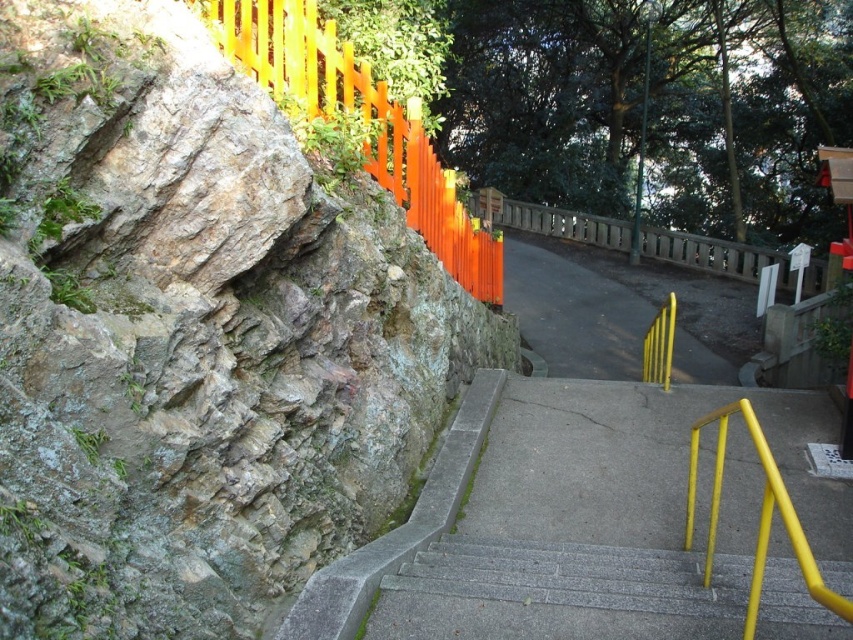
You are standing at the bottom of the staircase and want to reach the orange painted wood fence at upper left. Which direction should you move relative to the rocky cliff at left?

To reach the orange painted wood fence at upper left from the bottom of the staircase, you should move away from the rocky cliff at left since the fence is located above it.

You are a painter who needs to decide which object to paint first between the rocky cliff at left and the orange painted wood fence at upper left. Considering their widths, which one requires more time to paint due to its size?

The rocky cliff at left requires more time to paint because its width is larger than the orange painted wood fence at upper left.